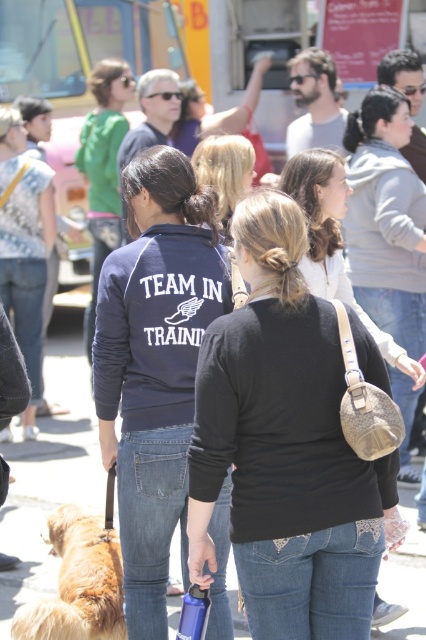
You are a photographer trying to capture a group photo of the navy blue fleece at center and the blonde hair at center. If you want to ensure both subjects are fully visible in the frame, which subject requires more space horizontally?

The navy blue fleece at center requires more horizontal space because its width is larger than the blonde hair at center.

You are a photographer at the event and want to take a photo of the black matte sweater at center and blonde hair at center. Which one is lower in the image?

The black matte sweater at center is positioned under blonde hair at center, so the black matte sweater at center is lower in the image.

You are a photographer trying to capture a clear shot of both the navy blue fleece at center and the blonde hair at center in the scene. Which object should you focus on first to ensure it appears sharp in the photo?

The navy blue fleece at center is larger in size than the blonde hair at center, so focusing on the navy blue fleece at center first will help ensure it appears sharp in the photo.